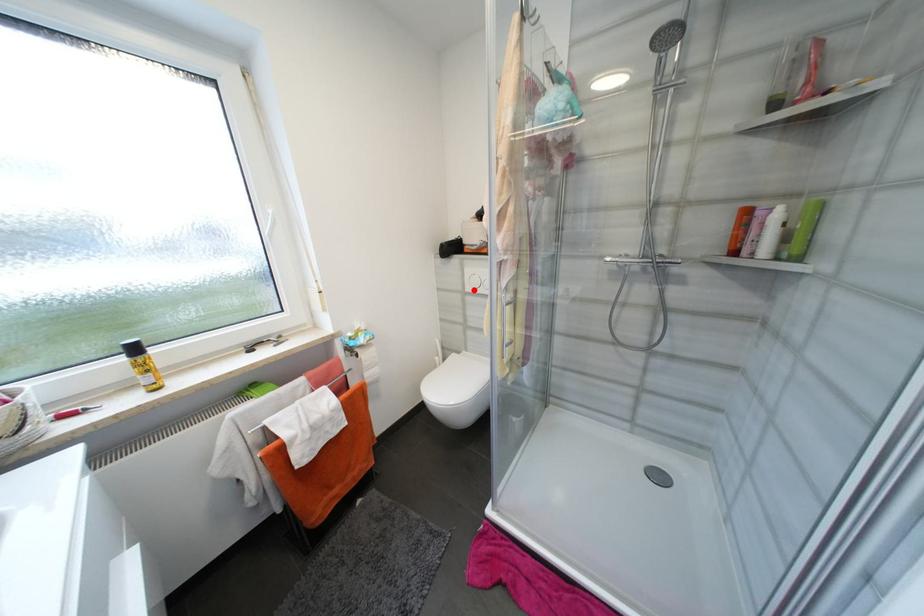
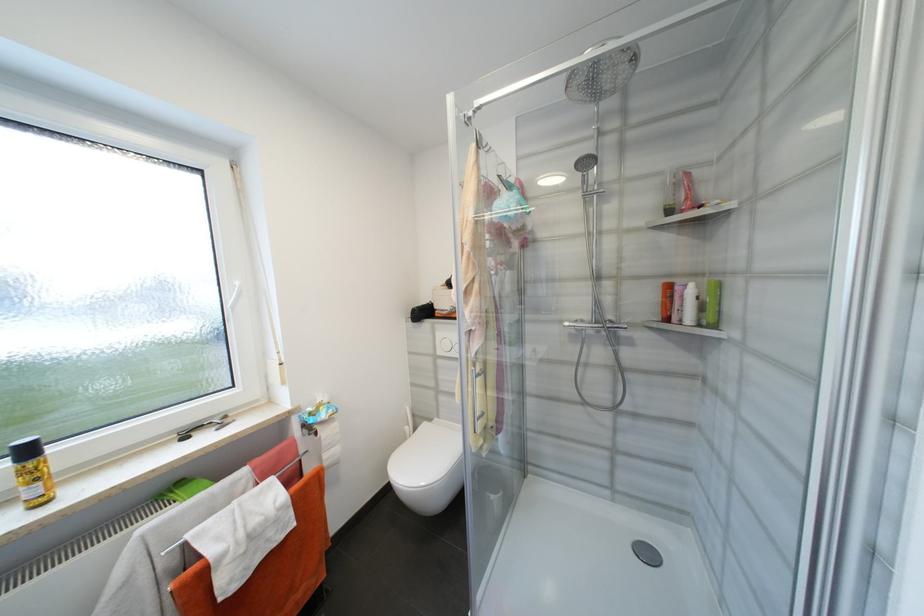
Question: I am providing you with two images of the same scene from different viewpoints. A red point is marked on the first image. At the location where the point appears in image 1, is it still visible in image 2?

Choices:
 (A) Yes
 (B) No

Answer: (A)